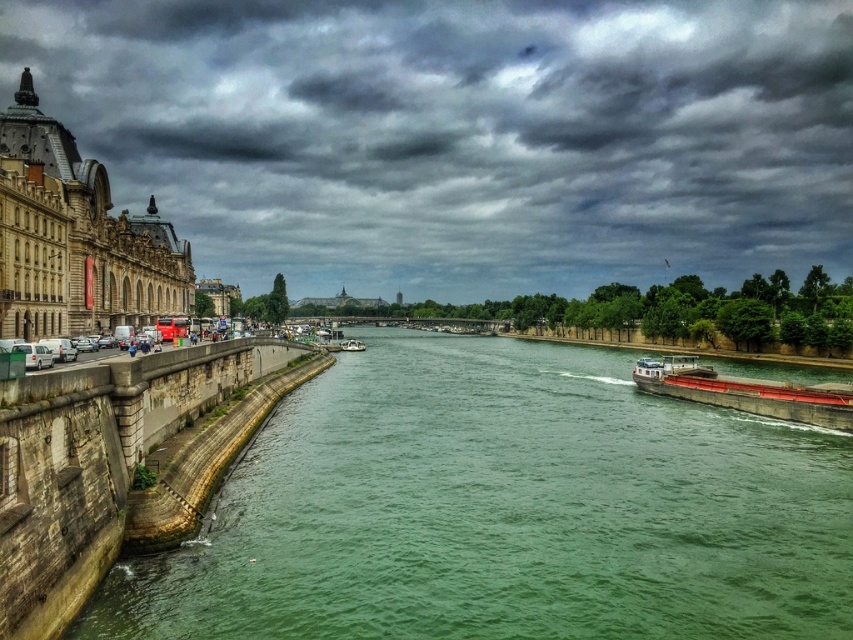
Looking at this image, does dark gray clouds at upper center appear over red matte barge at right?

Yes, dark gray clouds at upper center is above red matte barge at right.

Identify the location of dark gray clouds at upper center. (462, 134).

Is point (416, 13) closer to camera compared to point (799, 404)?

That is False.

You are a GUI agent. You are given a task and a screenshot of the screen. Output one action in this format:
    pyautogui.click(x=<x>, y=<y>)
    Task: Click on the dark gray clouds at upper center
    The image size is (853, 640).
    Given the screenshot: What is the action you would take?
    pyautogui.click(x=462, y=134)

Is point (392, 19) closer to camera compared to point (360, 344)?

No.

Can you confirm if dark gray clouds at upper center is shorter than white plastic boat at center?

No, dark gray clouds at upper center is not shorter than white plastic boat at center.

The height and width of the screenshot is (640, 853). I want to click on dark gray clouds at upper center, so click(462, 134).

This screenshot has width=853, height=640. Describe the element at coordinates (503, 509) in the screenshot. I see `green stone river at center` at that location.

From the picture: Who is more forward, (321, 541) or (666, 362)?

Positioned in front is point (321, 541).

Is point (396, 429) farther from viewer compared to point (677, 371)?

That is False.

Identify the location of green stone river at center. This screenshot has height=640, width=853. (503, 509).